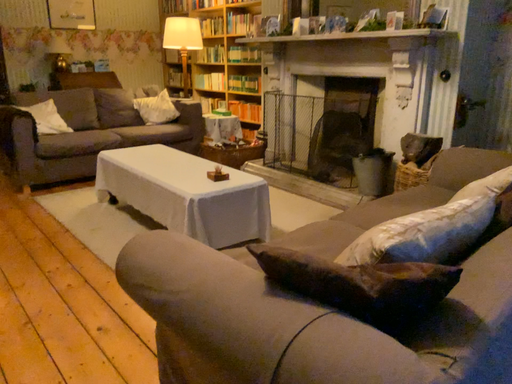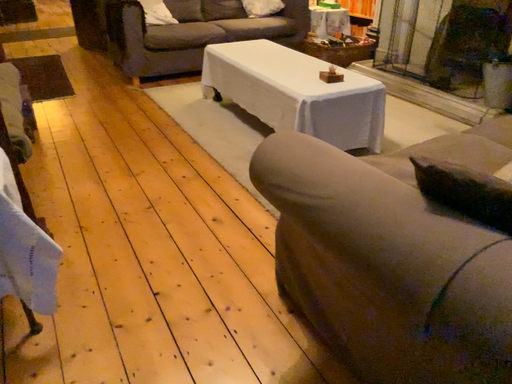
Question: How did the camera likely rotate when shooting the video?

Choices:
 (A) rotated downward
 (B) rotated upward

Answer: (A)